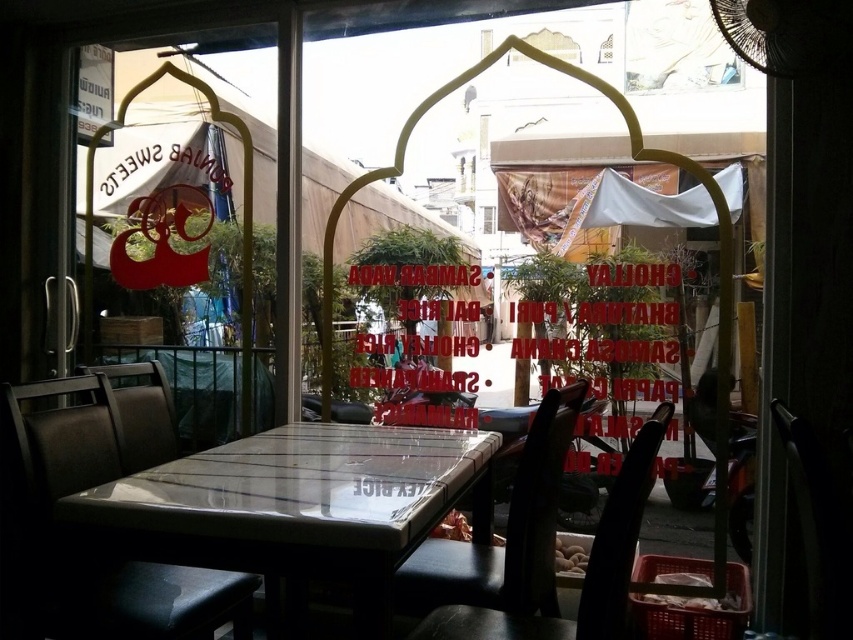
You are a delivery person carrying a large box that is 32 inches wide. You need to pass between the dark brown leather chair at center and the black leather chair at lower center. Is there enough space for you to pass through?

The dark brown leather chair at center and the black leather chair at lower center are 30.24 inches apart from each other. Since the box is 32 inches wide, there isn not enough space to pass through.

You are a delivery person trying to place a large pizza box on the matte glass table at center. The pizza box is 40 cm wide. Can the dark brown leather chair at center block the placement of the pizza box on the table?

The matte glass table at center might be wider than dark brown leather chair at center, so there is a possibility that the chair could block the placement depending on their exact dimensions. However, since the table is possibly wider, it might have enough space around it to accommodate the pizza box without obstruction from the chair.

You are standing at the entrance of the eatery and want to sit at the dark brown leather chair at center. According to the coordinates given, is the chair located closer to the left or right side of the room?

The dark brown leather chair at center is located at point 0.870 on the x axis, which is closer to the right side of the room.